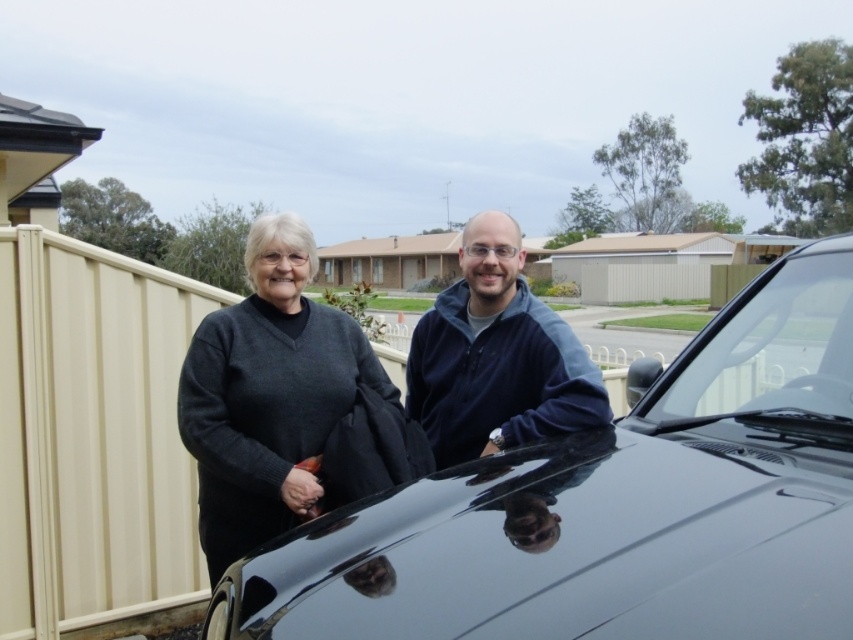
You are a delivery person trying to park your vehicle in a narrow driveway. The driveway can only accommodate one vehicle at a time. You see the glossy black car at center and the dark gray sweater at left in the image. Which object should you avoid hitting when entering the driveway?

You should avoid hitting the glossy black car at center because it is positioned on the right side of the dark gray sweater at left, meaning it is closer to the driveway entrance where you would be parking.

You are a delivery person trying to park your vehicle between the glossy black car at center and the clear glass windshield at upper center. Which side should you park on to ensure you are between them?

You should park to the right of the glossy black car at center because it is to the left of the clear glass windshield at upper center, so positioning yourself between them would require being on the right side of the glossy black car at center.

You are planning to park your car in a narrow driveway that can only accommodate vehicles up to the width of the dark gray sweater at left. Can the glossy black car at center fit in the driveway based on the scene?

The glossy black car at center is wider than the dark gray sweater at left, so it cannot fit in the driveway that can only accommodate the width of the dark gray sweater at left.